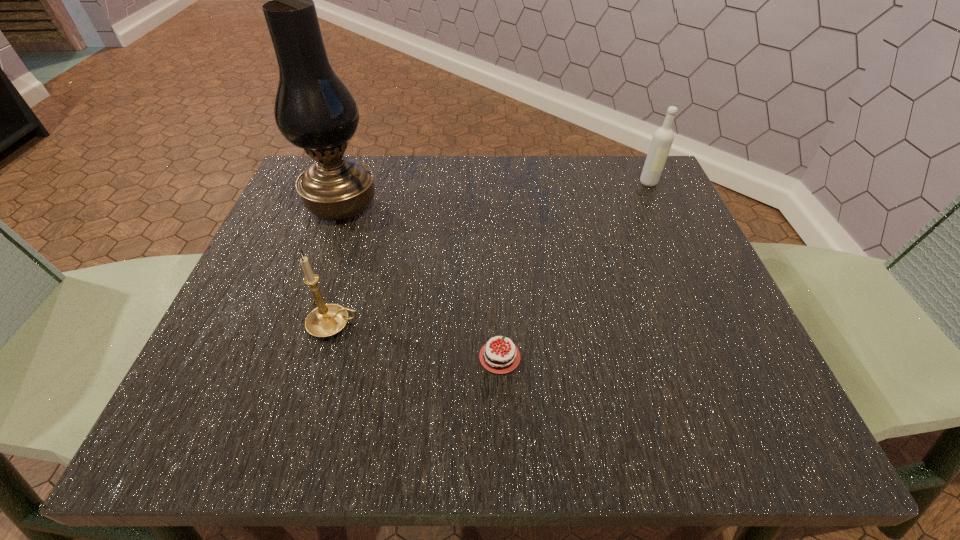
The height and width of the screenshot is (540, 960). Identify the location of unoccupied position between the vodka and the chocolate cake. (574, 270).

Identify the location of unoccupied position between the oil lamp and the vodka. Image resolution: width=960 pixels, height=540 pixels. (495, 194).

Find the location of a particular element. This screenshot has height=540, width=960. the third closest object relative to the tallest object is located at coordinates (662, 140).

Locate which object ranks second in proximity to the shortest object. Please provide its 2D coordinates. Your answer should be formatted as a tuple, i.e. [(x, y)], where the tuple contains the x and y coordinates of a point satisfying the conditions above.

[(314, 110)]

The image size is (960, 540). In order to click on vacant region that satisfies the following two spatial constraints: 1. on the back side of the shortest object; 2. on the left side of the rightmost object in this screenshot , I will do `click(493, 183)`.

Find the location of `vacant position in the image that satisfies the following two spatial constraints: 1. on the handle side of the candle holder; 2. on the right side of the chocolate cake`. vacant position in the image that satisfies the following two spatial constraints: 1. on the handle side of the candle holder; 2. on the right side of the chocolate cake is located at coordinates (325, 357).

Where is `free space that satisfies the following two spatial constraints: 1. on the back side of the tallest object; 2. on the left side of the rightmost object`? free space that satisfies the following two spatial constraints: 1. on the back side of the tallest object; 2. on the left side of the rightmost object is located at coordinates (350, 183).

At what (x,y) coordinates should I click in order to perform the action: click on free space that satisfies the following two spatial constraints: 1. on the handle side of the candle holder; 2. on the left side of the shortest object. Please return your answer as a coordinate pair (x, y). Image resolution: width=960 pixels, height=540 pixels. Looking at the image, I should click on (325, 357).